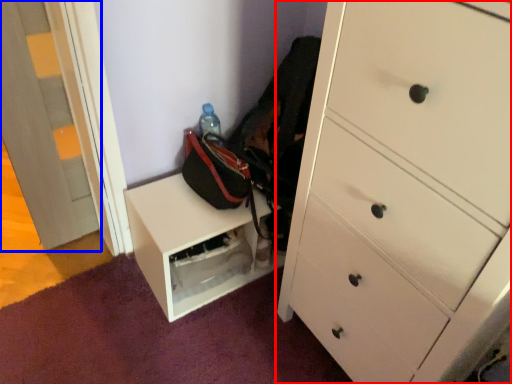
Question: Which of the following is the farthest to the observer, chest of drawers (highlighted by a red box) or door (highlighted by a blue box)?

Choices:
 (A) chest of drawers
 (B) door

Answer: (B)